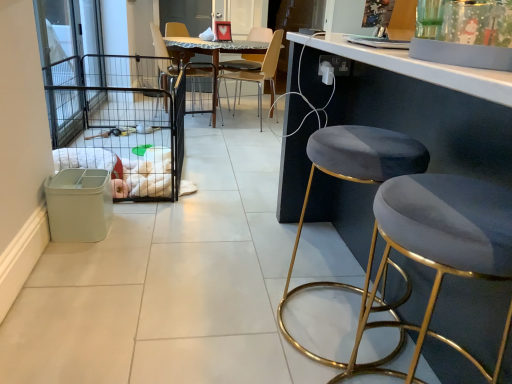
Find the location of a particular element. vacant space underneath velvet/golden stool at right, the 1th stool in the back-to-front sequence (from a real-world perspective) is located at coordinates (340, 321).